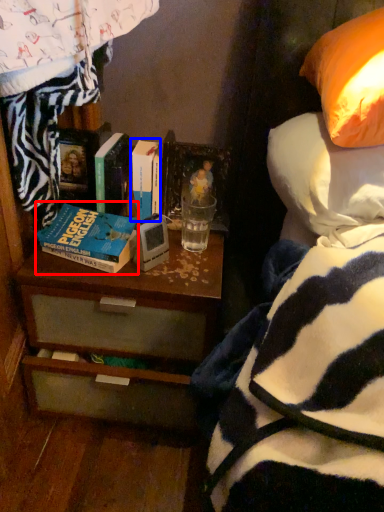
Question: Which point is closer to the camera, book (highlighted by a red box) or book (highlighted by a blue box)?

Choices:
 (A) book
 (B) book

Answer: (A)